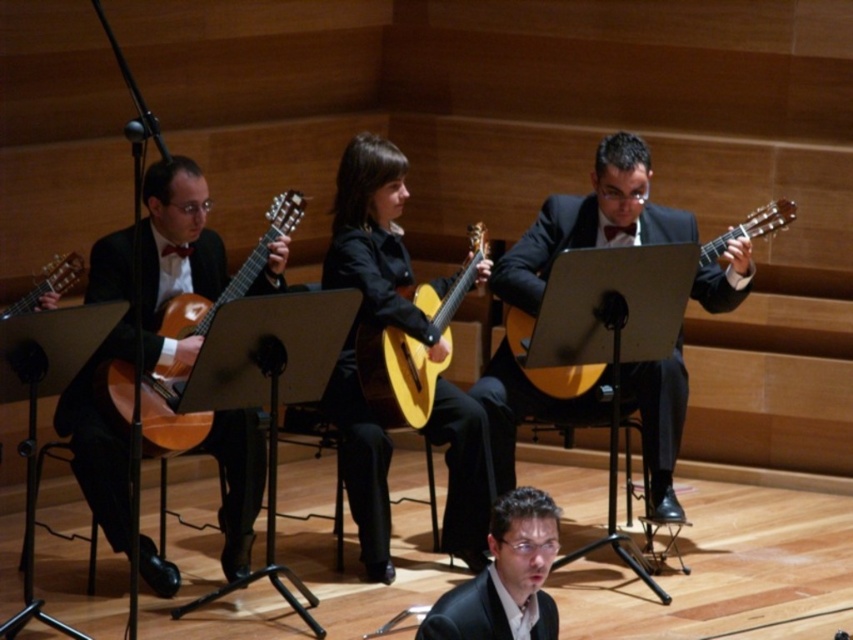
You are a stagehand adjusting the lighting for the concert. You need to place a spotlight on the point closer to the audience between point [537,499] and point [428,284]. Which point should you choose?

Point [537,499] is closer to the viewer than point [428,284], so you should place the spotlight on point [537,499].

You are a stagehand setting up a new microphone stand for the shiny black guitar at left and the matte black suit at lower center. Since you need to place the stand where it won

The shiny black guitar at left is much taller than the matte black suit at lower center, so the microphone stand should be positioned closer to the shiny black guitar at left to accommodate its height.

You are a stagehand setting up a microphone for the lead guitarist. The lead guitarist is positioned at point (231, 276). Which object is the lead guitarist standing near?

The lead guitarist at point (231, 276) is near the matte wood guitar at left.